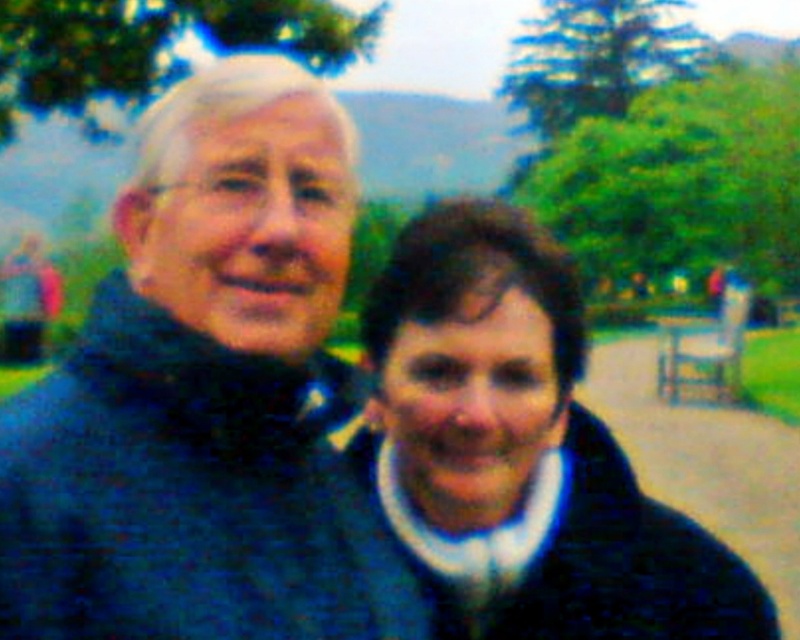
Which is more to the left, dark blue jacket at center or brown wooden bench at center?

Positioned to the left is dark blue jacket at center.

Is dark blue jacket at center further to the viewer compared to brown wooden bench at center?

No, dark blue jacket at center is in front of brown wooden bench at center.

The image size is (800, 640). Find the location of `dark blue jacket at center`. dark blue jacket at center is located at coordinates pos(520,452).